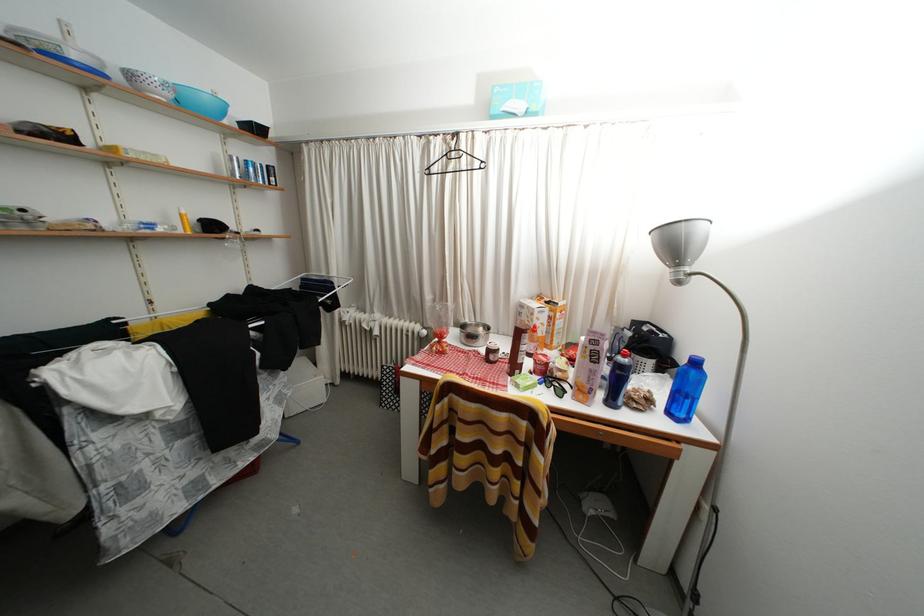
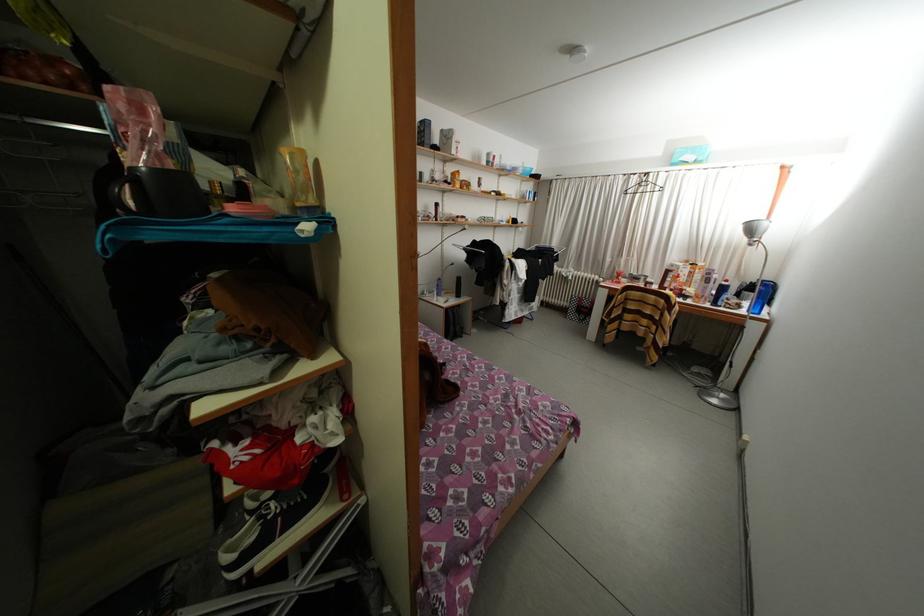
Where in the second image is the point corresponding to point 658,406 from the first image?

(747, 310)